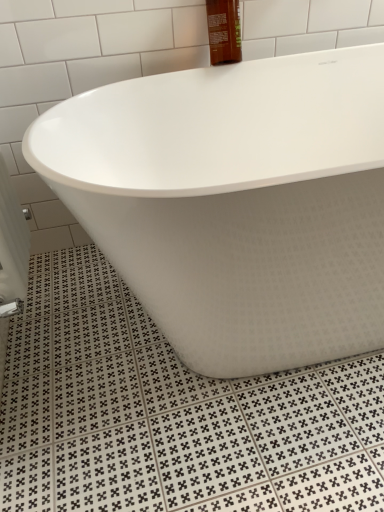
Question: Is white matte bathtub at center bigger than brown glass bottle at upper center?

Choices:
 (A) no
 (B) yes

Answer: (B)

Question: Can you confirm if white matte bathtub at center is shorter than brown glass bottle at upper center?

Choices:
 (A) yes
 (B) no

Answer: (B)

Question: Is brown glass bottle at upper center at the back of white matte bathtub at center?

Choices:
 (A) yes
 (B) no

Answer: (B)

Question: From the image's perspective, is white matte bathtub at center on brown glass bottle at upper center?

Choices:
 (A) no
 (B) yes

Answer: (A)

Question: Can you confirm if white matte bathtub at center is taller than brown glass bottle at upper center?

Choices:
 (A) no
 (B) yes

Answer: (B)

Question: Does white matte bathtub at center touch brown glass bottle at upper center?

Choices:
 (A) no
 (B) yes

Answer: (A)

Question: From a real-world perspective, is brown glass bottle at upper center beneath white matte bathtub at center?

Choices:
 (A) yes
 (B) no

Answer: (B)

Question: From the image's perspective, does brown glass bottle at upper center appear higher than white matte bathtub at center?

Choices:
 (A) no
 (B) yes

Answer: (B)

Question: Is brown glass bottle at upper center facing towards white matte bathtub at center?

Choices:
 (A) yes
 (B) no

Answer: (B)

Question: Is brown glass bottle at upper center to the left of white matte bathtub at center from the viewer's perspective?

Choices:
 (A) no
 (B) yes

Answer: (B)

Question: Does brown glass bottle at upper center have a greater width compared to white matte bathtub at center?

Choices:
 (A) yes
 (B) no

Answer: (B)

Question: Are brown glass bottle at upper center and white matte bathtub at center located far from each other?

Choices:
 (A) yes
 (B) no

Answer: (B)

Question: Is white matte bathtub at center situated inside brown glass bottle at upper center or outside?

Choices:
 (A) outside
 (B) inside

Answer: (A)